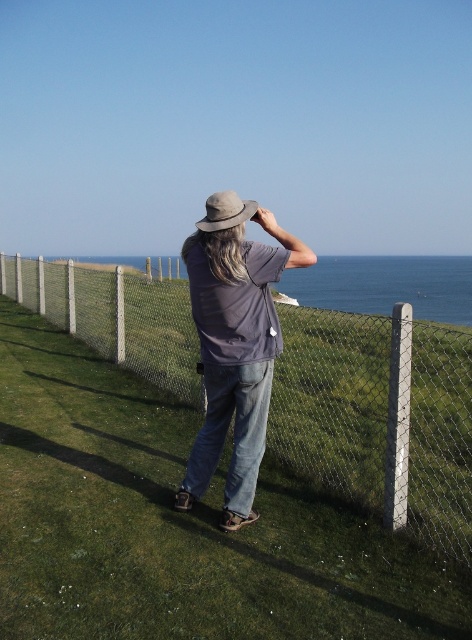
Is denim jeans at center above light brown felt hat at center?

Incorrect, denim jeans at center is not positioned above light brown felt hat at center.

Locate an element on the screen. Image resolution: width=472 pixels, height=640 pixels. denim jeans at center is located at coordinates (235, 342).

Is point (230, 346) positioned behind point (247, 212)?

No, (230, 346) is in front of (247, 212).

You are a GUI agent. You are given a task and a screenshot of the screen. Output one action in this format:
    pyautogui.click(x=<x>, y=<y>)
    Task: Click on the denim jeans at center
    
    Given the screenshot: What is the action you would take?
    pyautogui.click(x=235, y=342)

Between point (409, 435) and point (238, 380), which one is positioned behind?

The point (409, 435) is behind.

Can you confirm if wire mesh fence at center is positioned above denim jeans at center?

Correct, wire mesh fence at center is located above denim jeans at center.

Measure the distance between wire mesh fence at center and camera.

The distance of wire mesh fence at center from camera is 10.61 feet.

Image resolution: width=472 pixels, height=640 pixels. What are the coordinates of `wire mesh fence at center` in the screenshot? It's located at (379, 417).

Does wire mesh fence at center have a smaller size compared to light brown felt hat at center?

No, wire mesh fence at center is not smaller than light brown felt hat at center.

Is point (272, 404) positioned before point (239, 211)?

No, (272, 404) is behind (239, 211).

This screenshot has width=472, height=640. I want to click on wire mesh fence at center, so click(379, 417).